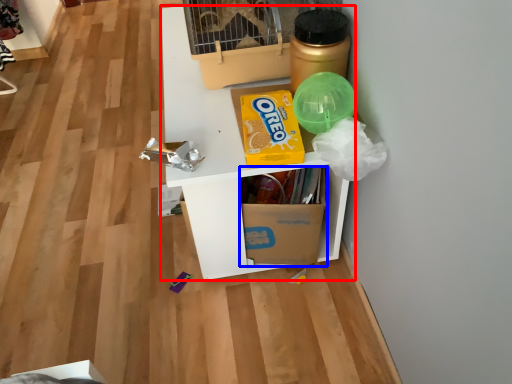
Question: Which object is further to the camera taking this photo, furniture (highlighted by a red box) or cardboard box (highlighted by a blue box)?

Choices:
 (A) furniture
 (B) cardboard box

Answer: (B)